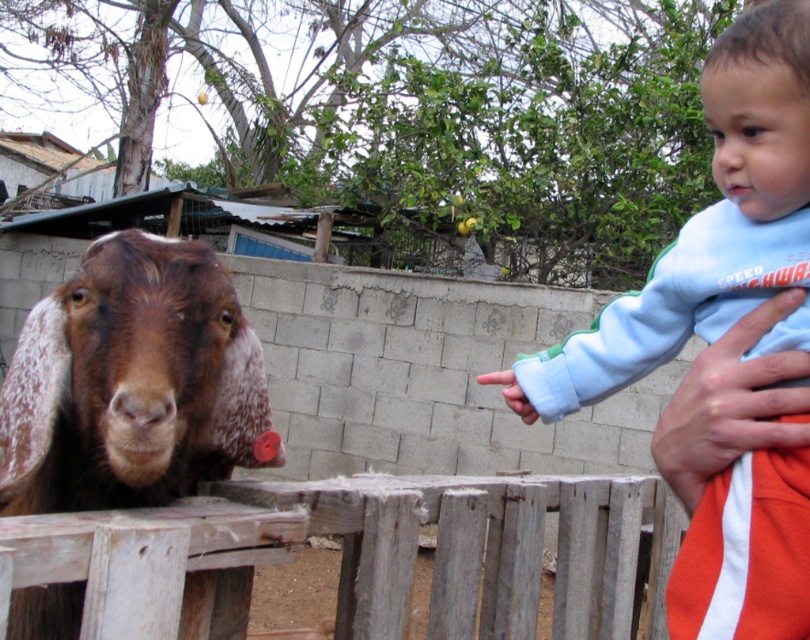
Is point (745, 250) positioned after point (158, 476)?

Yes, it is.

Measure the distance between point (789, 572) and camera.

Point (789, 572) is 31.56 inches from camera.

What do you see at coordinates (706, 228) in the screenshot?
I see `light blue fleece at upper right` at bounding box center [706, 228].

Locate an element on the screen. The height and width of the screenshot is (640, 810). light blue fleece at upper right is located at coordinates (706, 228).

Consider the image. Can you confirm if weathered wood fence at center is smaller than brown speckled fur at left?

Incorrect, weathered wood fence at center is not smaller in size than brown speckled fur at left.

Is weathered wood fence at center bigger than brown speckled fur at left?

Indeed, weathered wood fence at center has a larger size compared to brown speckled fur at left.

Is point (186, 518) more distant than point (254, 396)?

No, (186, 518) is closer to viewer.

This screenshot has width=810, height=640. What are the coordinates of `weathered wood fence at center` in the screenshot? It's located at (360, 556).

Does weathered wood fence at center have a lesser width compared to light blue fleece at upper right?

Incorrect, weathered wood fence at center's width is not less than light blue fleece at upper right's.

You are a GUI agent. You are given a task and a screenshot of the screen. Output one action in this format:
    pyautogui.click(x=<x>, y=<y>)
    Task: Click on the weathered wood fence at center
    The height and width of the screenshot is (640, 810).
    Given the screenshot: What is the action you would take?
    pyautogui.click(x=360, y=556)